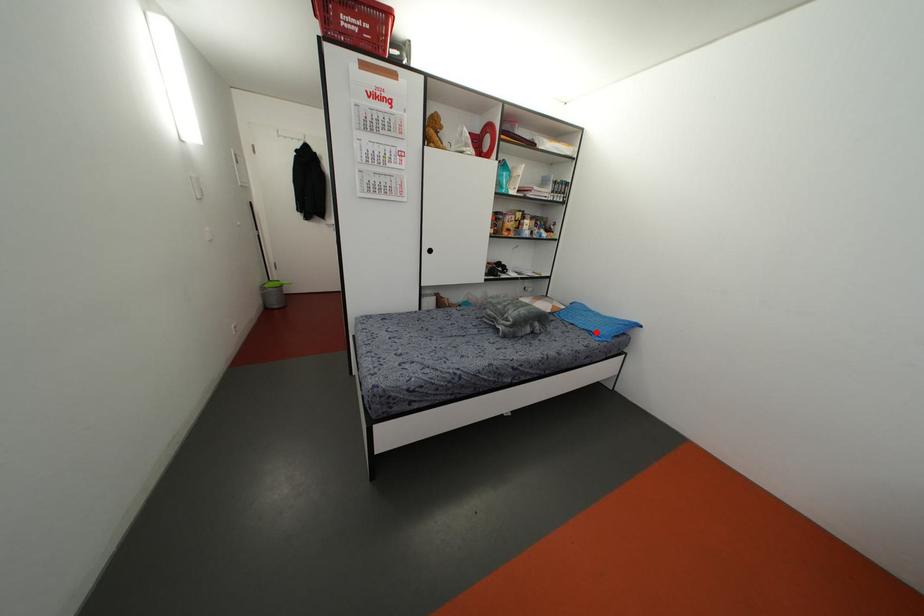
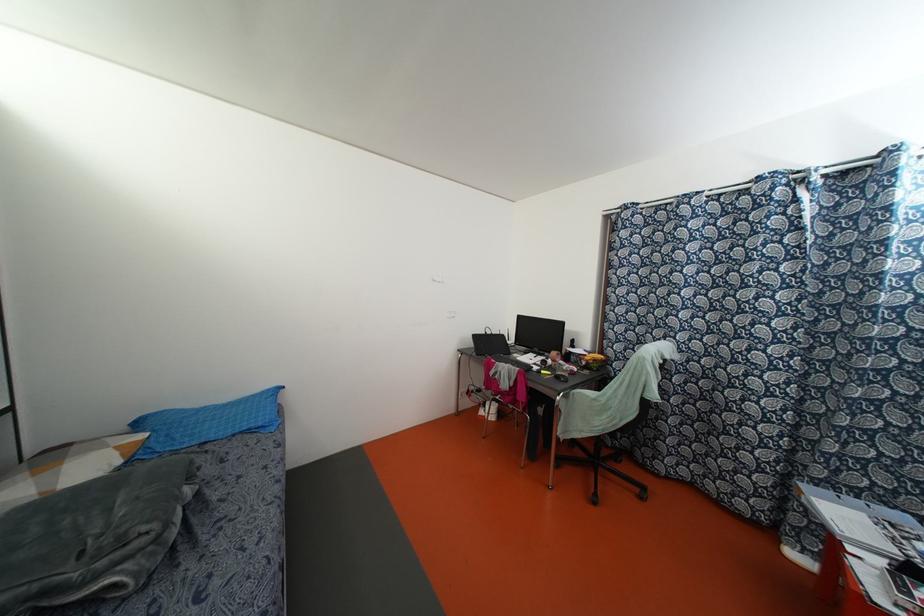
Question: I am providing you with two images of the same scene from different viewpoints. Image1 has a red point marked. In image2, the corresponding 3D location appears at what relative position? Reply with the corresponding letter.

Choices:
 (A) Closer
 (B) Farther

Answer: (A)